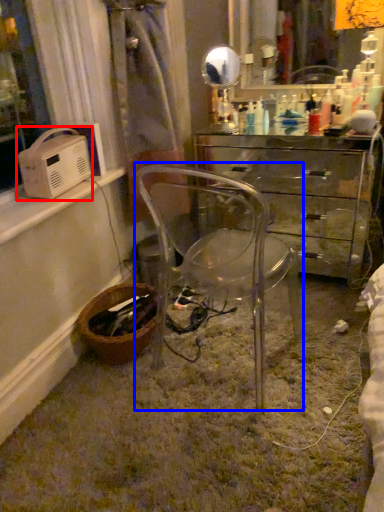
Question: Which of the following is the farthest to the observer, appliance (highlighted by a red box) or chair (highlighted by a blue box)?

Choices:
 (A) appliance
 (B) chair

Answer: (A)